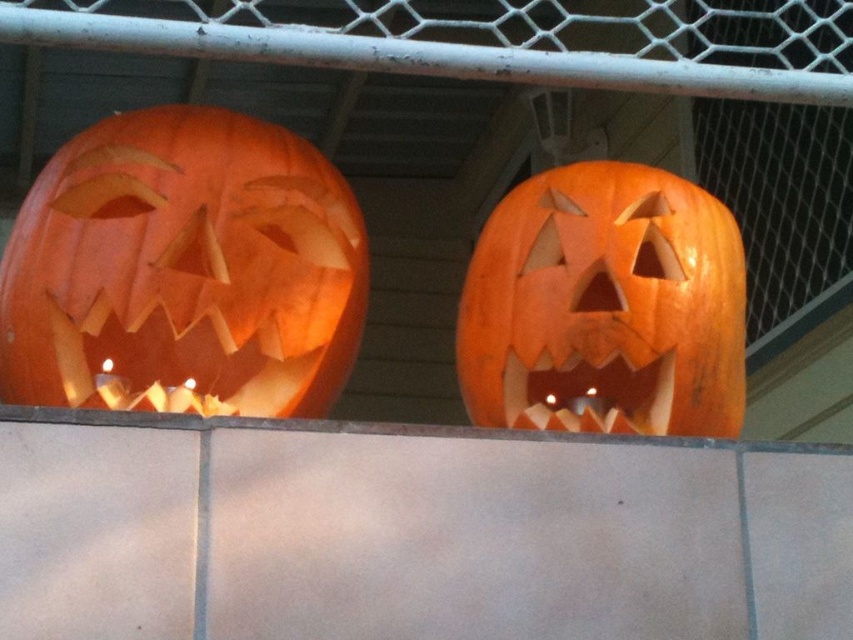
Who is more distant from viewer, (218, 260) or (498, 380)?

The point (498, 380) is more distant.

From the picture: Who is taller, orange carved pumpkin at left or orange carved pumpkin at center?

orange carved pumpkin at left

Is point (138, 180) positioned before point (706, 433)?

Yes.

Image resolution: width=853 pixels, height=640 pixels. I want to click on orange carved pumpkin at left, so click(184, 269).